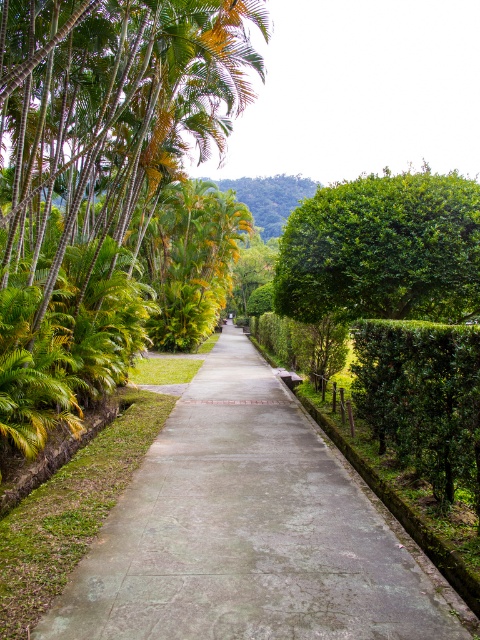
Question: In this image, where is green concrete pavement at center located relative to green leafy hedge at right?

Choices:
 (A) right
 (B) left

Answer: (B)

Question: Which is nearer to the green leafy bush at center right?

Choices:
 (A) green leafy hedge at right
 (B) green concrete pavement at center

Answer: (A)

Question: Is green leafy bush at center right bigger than green leafy hedge at right?

Choices:
 (A) no
 (B) yes

Answer: (B)

Question: Considering the relative positions of green leafy bush at center right and green leafy hedge at right in the image provided, where is green leafy bush at center right located with respect to green leafy hedge at right?

Choices:
 (A) below
 (B) above

Answer: (B)

Question: Which of the following is the farthest from the observer?

Choices:
 (A) (466, 346)
 (B) (326, 472)
 (C) (286, 305)

Answer: (C)

Question: Among these points, which one is nearest to the camera?

Choices:
 (A) (389, 307)
 (B) (384, 362)
 (C) (241, 605)

Answer: (C)